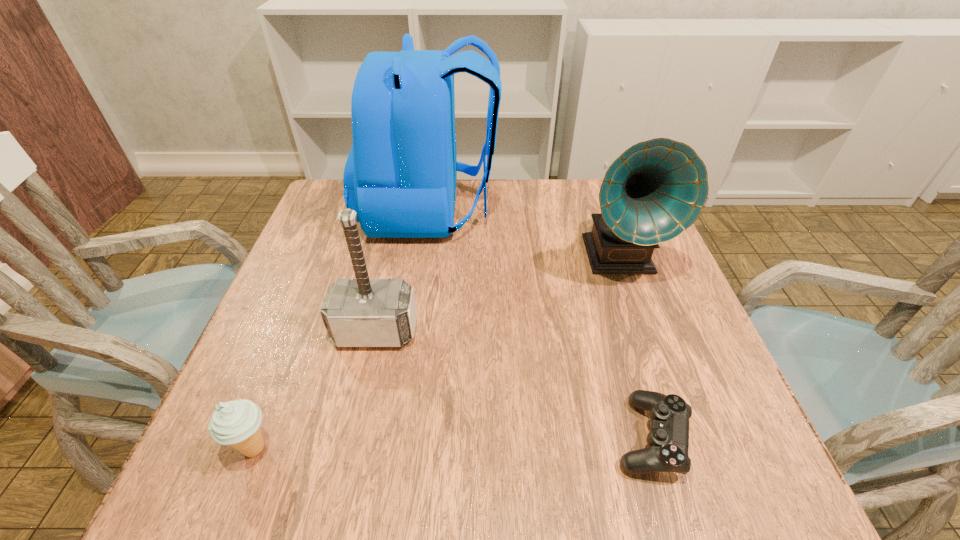
The image size is (960, 540). I want to click on vacant space located on the back of the control, so click(620, 335).

This screenshot has width=960, height=540. I want to click on backpack that is at the far edge, so click(400, 176).

Find the location of a particular element. phonograph_record that is at the far edge is located at coordinates (655, 190).

Where is `icecream present at the near edge`? icecream present at the near edge is located at coordinates (236, 423).

This screenshot has width=960, height=540. Find the location of `control at the near edge`. control at the near edge is located at coordinates (668, 440).

In order to click on backpack present at the left edge in this screenshot , I will do `click(400, 176)`.

Where is `hammer located in the left edge section of the desktop`? The width and height of the screenshot is (960, 540). hammer located in the left edge section of the desktop is located at coordinates (362, 312).

Locate an element on the screen. icecream that is positioned at the left edge is located at coordinates (236, 423).

Locate an element on the screen. The height and width of the screenshot is (540, 960). phonograph_record that is positioned at the right edge is located at coordinates (655, 190).

Image resolution: width=960 pixels, height=540 pixels. What are the coordinates of `control located at the right edge` in the screenshot? It's located at (668, 440).